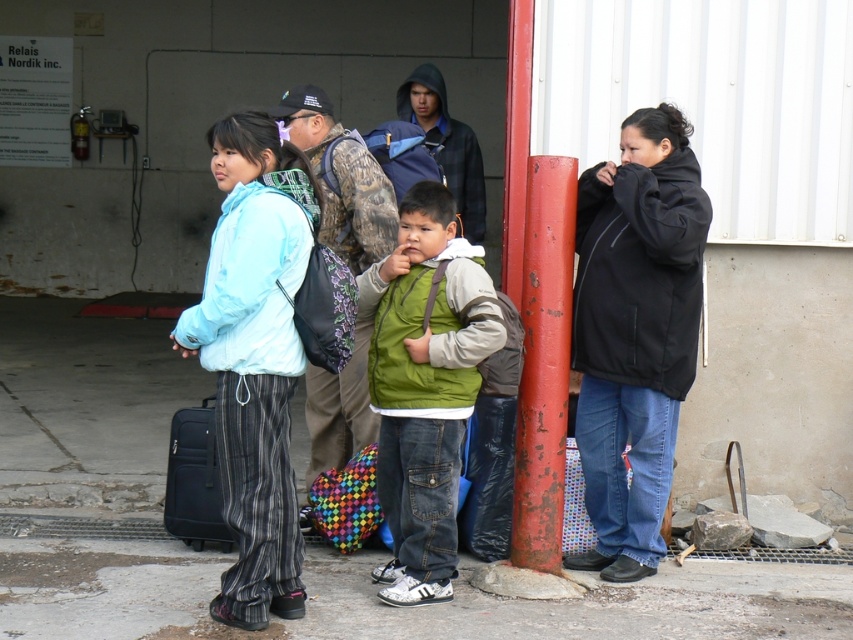
You are standing at point (x=254, y=356) in the industrial area. Which object is exactly at your current position?

The light blue fabric jacket at left is located at point (x=254, y=356), so the object exactly at your current position is the light blue fabric jacket at left.

You are a delivery person who needs to deliver a package to the person wearing the black softshell jacket at center. You are currently standing at the entrance of the building. Which direction should you walk to reach them?

The black softshell jacket at center is located at coordinates point (635, 332), so you should walk towards the center of the image to reach them.